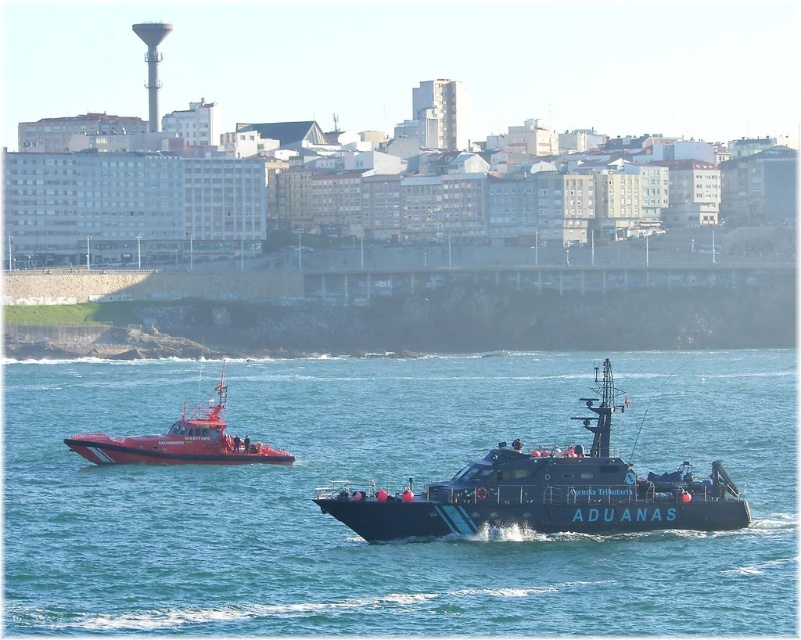
Question: Which object appears closest to the camera in this image?

Choices:
 (A) red rubber boat at left
 (B) black matte boat at center
 (C) blue water at center

Answer: (C)

Question: Where is blue water at center located in relation to red rubber boat at left in the image?

Choices:
 (A) right
 (B) left

Answer: (A)

Question: Which of these objects is positioned farthest from the black matte boat at center?

Choices:
 (A) red rubber boat at left
 (B) blue water at center

Answer: (B)

Question: Does blue water at center lie behind black matte boat at center?

Choices:
 (A) no
 (B) yes

Answer: (A)

Question: Can you confirm if black matte boat at center is bigger than red rubber boat at left?

Choices:
 (A) no
 (B) yes

Answer: (B)

Question: Which object is closer to the camera taking this photo?

Choices:
 (A) red rubber boat at left
 (B) blue water at center

Answer: (B)